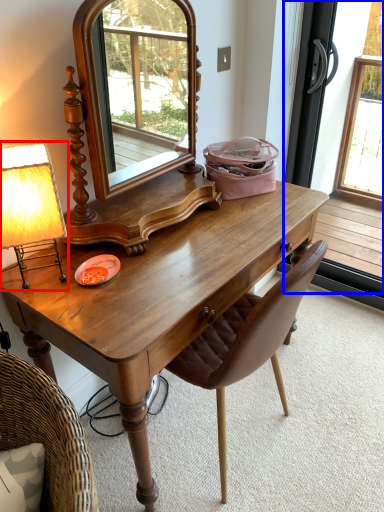
Question: Which object is closer to the camera taking this photo, table lamp (highlighted by a red box) or screen door (highlighted by a blue box)?

Choices:
 (A) table lamp
 (B) screen door

Answer: (A)